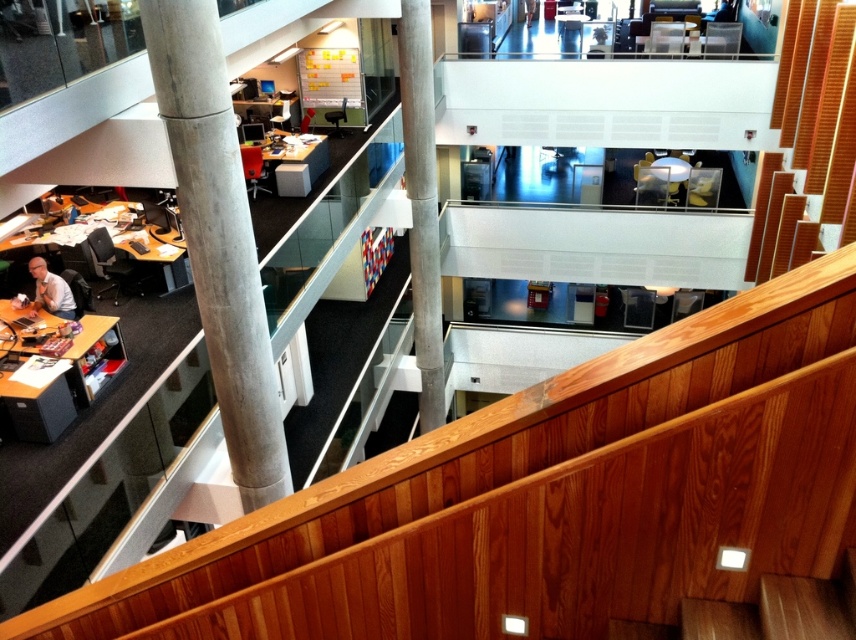
Question: Which object is the closest to the concrete pillar at center?

Choices:
 (A) matte gray shirt at lower left
 (B) concrete at left
 (C) matte black desk at lower left

Answer: (C)

Question: Does concrete at left appear under concrete pillar at center?

Choices:
 (A) no
 (B) yes

Answer: (B)

Question: Which of the following is the closest to the observer?

Choices:
 (A) concrete at left
 (B) concrete pillar at center

Answer: (A)

Question: Does concrete pillar at center have a smaller size compared to matte gray shirt at lower left?

Choices:
 (A) no
 (B) yes

Answer: (A)

Question: Is concrete at left smaller than matte black desk at lower left?

Choices:
 (A) no
 (B) yes

Answer: (B)

Question: Based on their relative distances, which object is nearer to the concrete at left?

Choices:
 (A) concrete pillar at center
 (B) matte black desk at lower left
 (C) wooden stairs at upper center

Answer: (B)